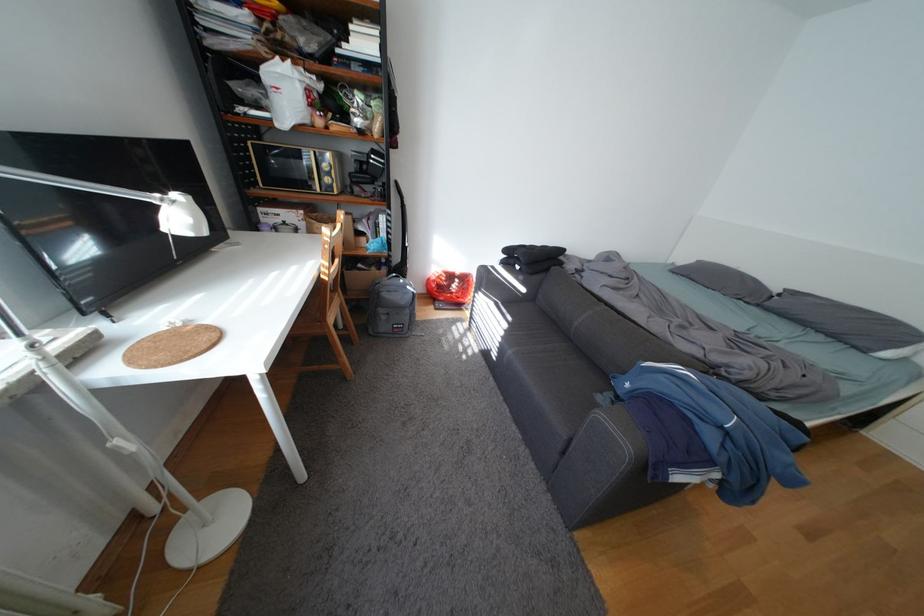
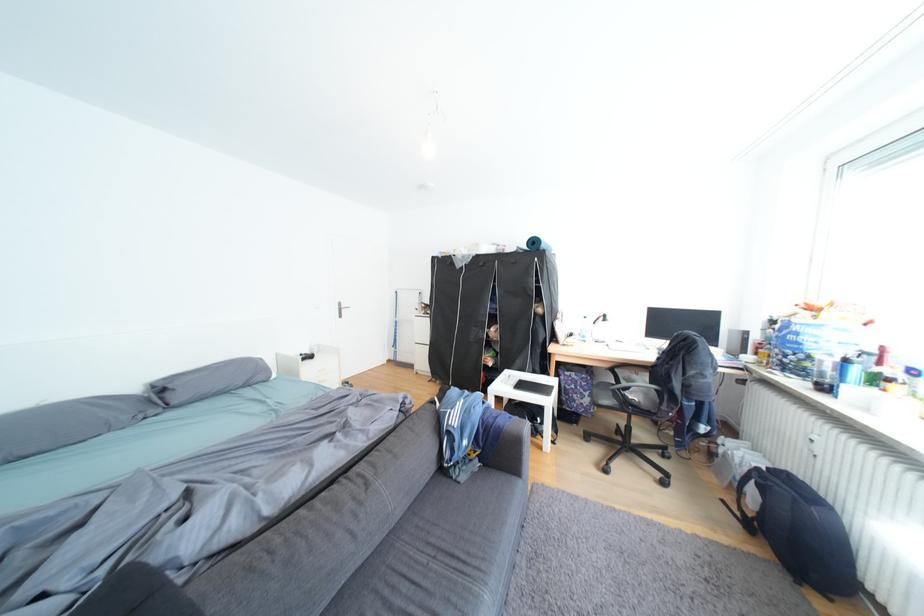
Locate, in the second image, the point that corresponds to point 639,386 in the first image.

(478, 444)